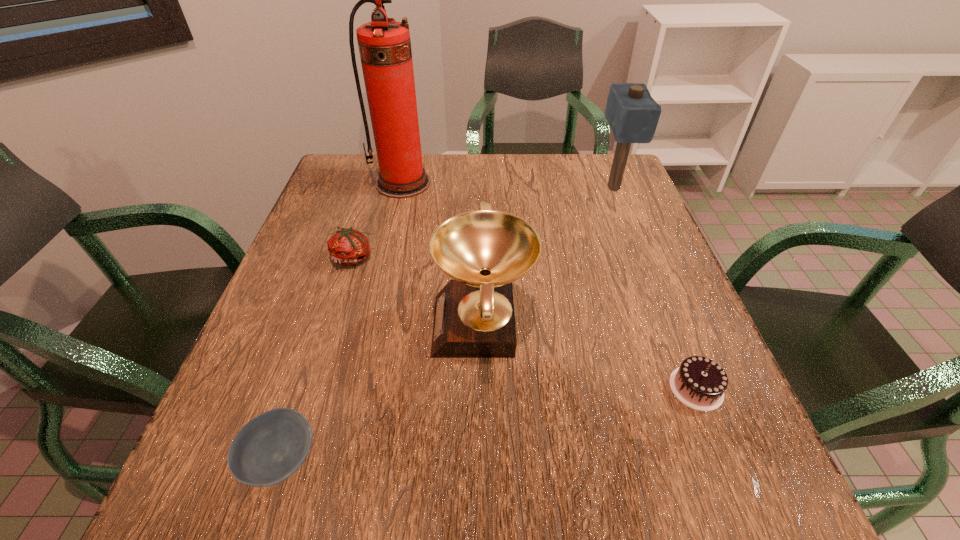
I want to click on tomato at the left edge, so click(x=348, y=246).

Where is `bowl at the left edge`? This screenshot has height=540, width=960. bowl at the left edge is located at coordinates (267, 450).

This screenshot has width=960, height=540. Identify the location of mallet present at the right edge. (632, 113).

Image resolution: width=960 pixels, height=540 pixels. In order to click on chocolate cake located in the right edge section of the desktop in this screenshot , I will do `click(699, 383)`.

Locate an element on the screen. object that is at the far left corner is located at coordinates (384, 44).

I want to click on object present at the near left corner, so click(x=267, y=450).

Image resolution: width=960 pixels, height=540 pixels. Identify the location of object that is positioned at the far right corner. (632, 113).

Find the location of a particular element. This screenshot has width=960, height=540. blank area at the far edge is located at coordinates (453, 187).

Locate an element on the screen. This screenshot has height=540, width=960. vacant space at the near edge is located at coordinates (624, 509).

Find the location of a particular element. The width and height of the screenshot is (960, 540). vacant region at the left edge is located at coordinates (324, 295).